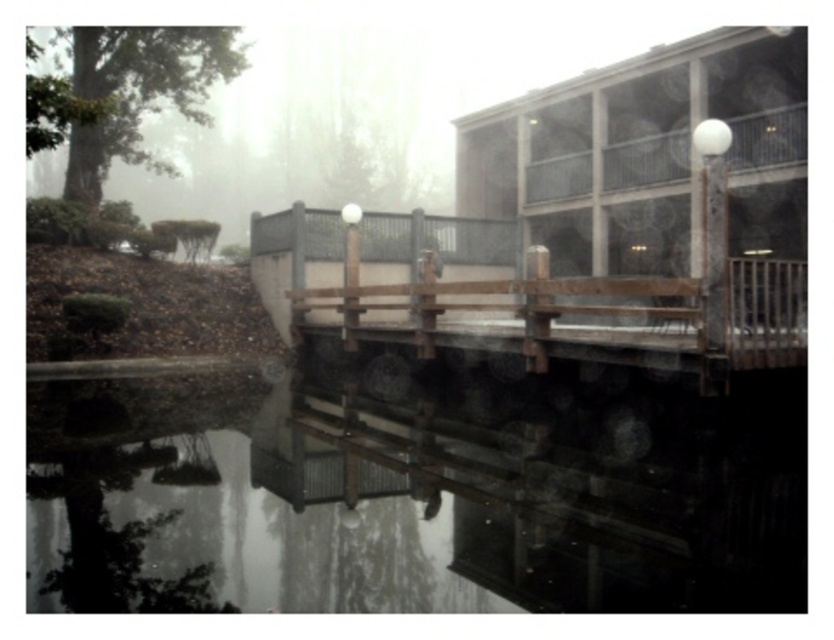
You are standing on the wooden bridge and looking down at the water. There is a point at coordinates point (407,499). What is the nature of the surface at that point?

The transparent water at center is represented by point (407,499), so the surface at that point is transparent water.

You are an artist trying to sketch the scene. You need to decide which object, the transparent water at center or the wooden bench at center, requires more detailed shading due to its thickness. Which one should you focus on?

The wooden bench at center requires more detailed shading because it is thicker than the transparent water at center.

You are standing on the wooden bridge and want to sit down. Which object at center is larger and suitable for sitting, the transparent water at center or the wooden bench at center?

The wooden bench at center is larger than the transparent water at center, so it is suitable for sitting.